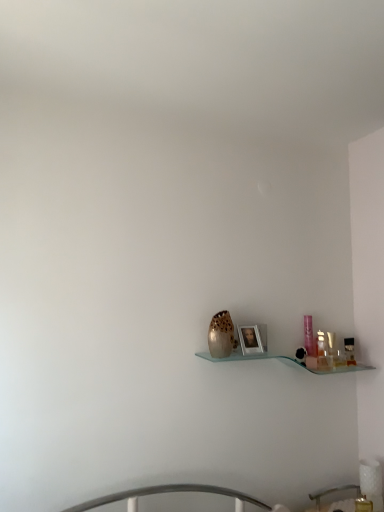
Question: From a real-world perspective, is translucent plastic bottle at right, the first toiletry from the left, above or below translucent glass vase at center?

Choices:
 (A) below
 (B) above

Answer: (A)

Question: Considering the positions of translucent plastic bottle at right, the 2th toiletry positioned from the right, and translucent glass vase at center in the image, is translucent plastic bottle at right, the 2th toiletry positioned from the right, bigger or smaller than translucent glass vase at center?

Choices:
 (A) small
 (B) big

Answer: (A)

Question: Which is farther from the translucent plastic bottle at right, the 2th toiletry positioned from the right?

Choices:
 (A) translucent glass vase at center
 (B) black plastic toiletry at right, the first toiletry positioned from the right
 (C) metallic silver frame at center

Answer: (A)

Question: Which is nearer to the black plastic toiletry at right, the first toiletry positioned from the right?

Choices:
 (A) translucent glass vase at center
 (B) translucent plastic bottle at right, the 2th toiletry positioned from the right
 (C) metallic silver frame at center

Answer: (B)